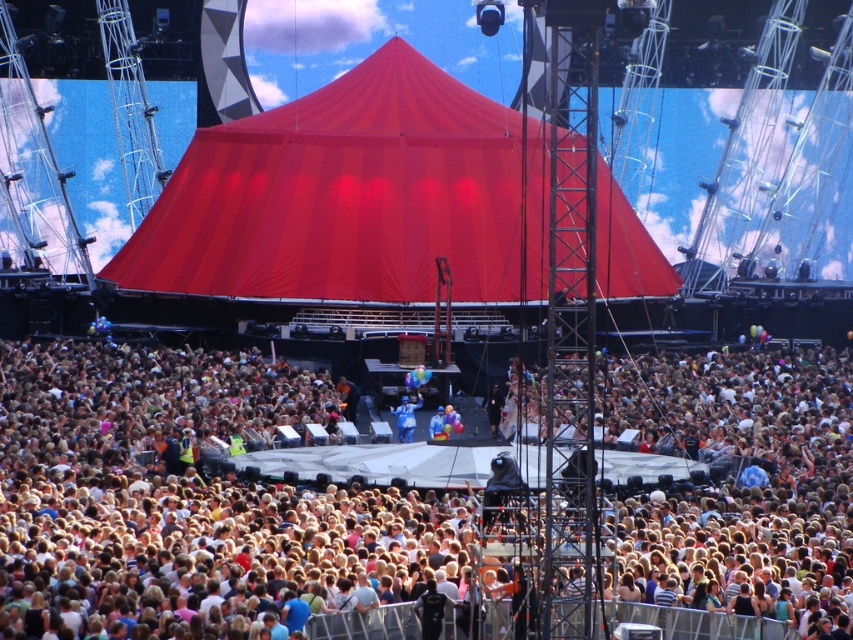
Question: Which object is positioned closest to the red fabric canopy at center?

Choices:
 (A) blue fabric at center
 (B) white cotton crowd at center

Answer: (B)

Question: In this image, where is red fabric canopy at center located relative to blue fabric at center?

Choices:
 (A) below
 (B) above

Answer: (B)

Question: Which of the following is the farthest from the observer?

Choices:
 (A) (840, 438)
 (B) (405, 422)

Answer: (B)

Question: Observing the image, what is the correct spatial positioning of white cotton crowd at center in reference to blue fabric at center?

Choices:
 (A) left
 (B) right

Answer: (B)

Question: Considering the real-world distances, which object is closest to the white cotton crowd at center?

Choices:
 (A) blue fabric at center
 (B) red fabric canopy at center

Answer: (B)

Question: Can you confirm if white cotton crowd at center is positioned to the left of red fabric canopy at center?

Choices:
 (A) no
 (B) yes

Answer: (A)